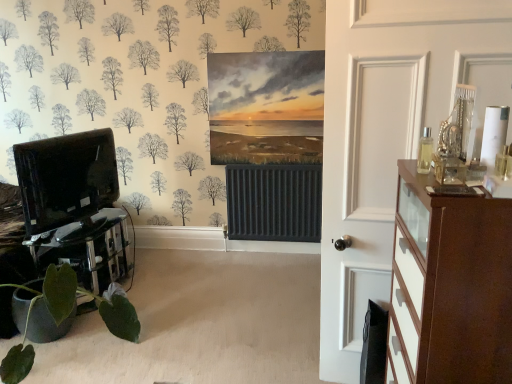
Question: Considering the relative positions of green matte plant at lower left and black glass table at lower left in the image provided, is green matte plant at lower left to the left of black glass table at lower left from the viewer's perspective?

Choices:
 (A) no
 (B) yes

Answer: (A)

Question: Could you tell me if green matte plant at lower left is facing black glass table at lower left?

Choices:
 (A) yes
 (B) no

Answer: (B)

Question: Considering the relative sizes of green matte plant at lower left and black glass table at lower left in the image provided, is green matte plant at lower left taller than black glass table at lower left?

Choices:
 (A) yes
 (B) no

Answer: (A)

Question: From a real-world perspective, is green matte plant at lower left on black glass table at lower left?

Choices:
 (A) yes
 (B) no

Answer: (A)

Question: Can you confirm if green matte plant at lower left is smaller than black glass table at lower left?

Choices:
 (A) no
 (B) yes

Answer: (A)

Question: Considering the positions of black glossy entertainment center at left and green matte plant at lower left in the image, is black glossy entertainment center at left taller or shorter than green matte plant at lower left?

Choices:
 (A) tall
 (B) short

Answer: (A)

Question: Is black glossy entertainment center at left in front of or behind green matte plant at lower left in the image?

Choices:
 (A) behind
 (B) front

Answer: (A)

Question: From the image's perspective, is black glossy entertainment center at left positioned above or below green matte plant at lower left?

Choices:
 (A) above
 (B) below

Answer: (A)

Question: Looking at the image, does black glossy entertainment center at left seem bigger or smaller compared to green matte plant at lower left?

Choices:
 (A) big
 (B) small

Answer: (B)

Question: Is point (115, 231) positioned closer to the camera than point (71, 283)?

Choices:
 (A) closer
 (B) farther

Answer: (B)

Question: Is black glass table at lower left inside the boundaries of green matte plant at lower left, or outside?

Choices:
 (A) outside
 (B) inside

Answer: (A)

Question: Looking at their shapes, would you say black glass table at lower left is wider or thinner than green matte plant at lower left?

Choices:
 (A) wide
 (B) thin

Answer: (B)

Question: Relative to green matte plant at lower left, is black glass table at lower left in front or behind?

Choices:
 (A) behind
 (B) front

Answer: (A)

Question: From the image's perspective, is brown wood chest of drawers at right above or below green matte plant at lower left?

Choices:
 (A) above
 (B) below

Answer: (A)

Question: In terms of width, does brown wood chest of drawers at right look wider or thinner when compared to green matte plant at lower left?

Choices:
 (A) thin
 (B) wide

Answer: (A)